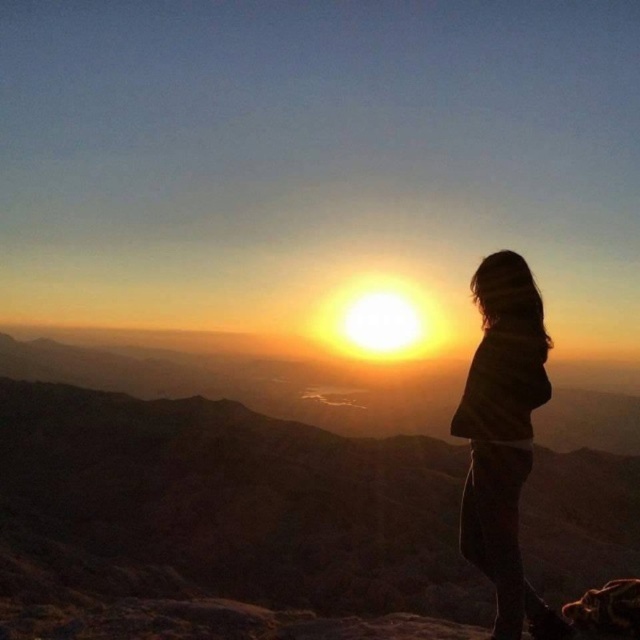
You are a hiker who wants to take a photo of the brown rocky mountain at center and the brown textured sweater at right in the same frame. Your camera has a maximum focus range of 20 meters. Will both objects be in focus if you position yourself at the starting point?

The distance between the brown rocky mountain at center and the brown textured sweater at right is 17.98 meters, which is within the camera maximum focus range of 20 meters. Therefore, both objects will be in focus.